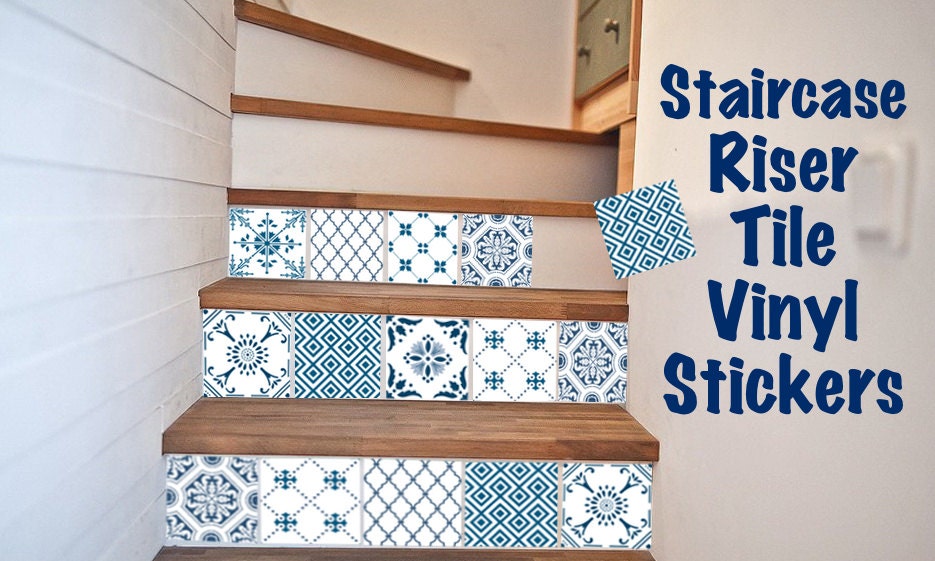
Where is `plain white front of steps`? The image size is (935, 561). plain white front of steps is located at coordinates (304, 75), (338, 147).